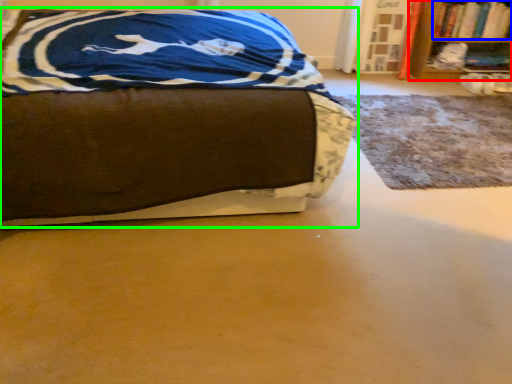
Question: Estimate the real-world distances between objects in this image. Which object is farther from bookcase (highlighted by a red box), book (highlighted by a blue box) or bed (highlighted by a green box)?

Choices:
 (A) book
 (B) bed

Answer: (B)